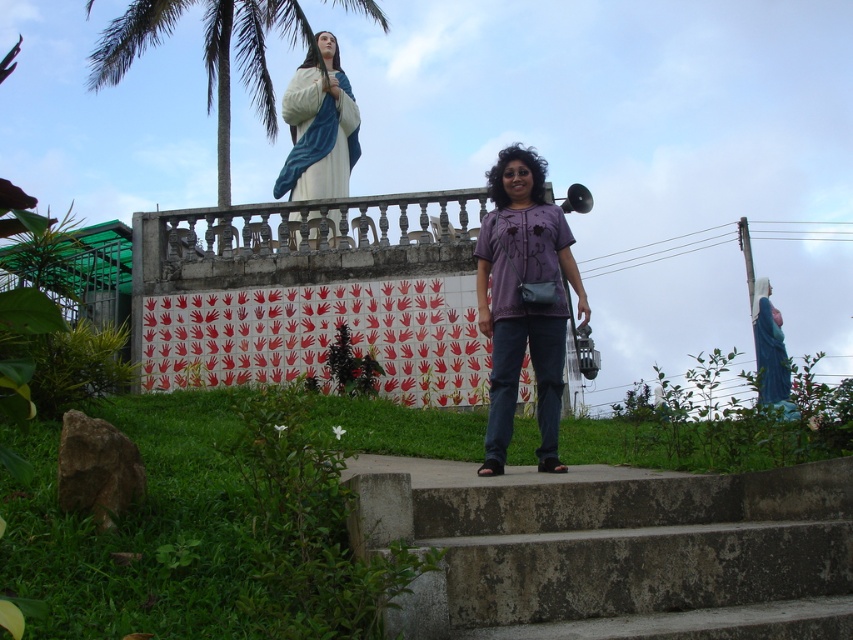
Locate an element on the screen. purple cotton shirt at center is located at coordinates (523, 300).

Where is `purple cotton shirt at center`? purple cotton shirt at center is located at coordinates (523, 300).

Between concrete stairs at center and matte white statue at upper center, which one has less height?

With less height is concrete stairs at center.

Does concrete stairs at center have a greater width compared to matte white statue at upper center?

Correct, the width of concrete stairs at center exceeds that of matte white statue at upper center.

Find the location of a particular element. The height and width of the screenshot is (640, 853). concrete stairs at center is located at coordinates (613, 548).

Who is positioned more to the left, purple cotton shirt at center or green leafy palm tree at upper left?

green leafy palm tree at upper left is more to the left.

Is purple cotton shirt at center thinner than green leafy palm tree at upper left?

Yes.

Describe the element at coordinates (523, 300) in the screenshot. The width and height of the screenshot is (853, 640). I see `purple cotton shirt at center` at that location.

The image size is (853, 640). I want to click on purple cotton shirt at center, so click(523, 300).